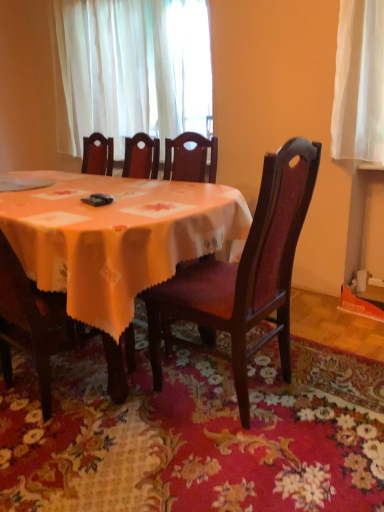
This screenshot has width=384, height=512. What are the coordinates of `white sheer curtain at upper center` in the screenshot? It's located at (130, 69).

The image size is (384, 512). What are the coordinates of `wooden chair at center, the first chair when ordered from left to right` in the screenshot? It's located at (45, 329).

The height and width of the screenshot is (512, 384). What do you see at coordinates (245, 273) in the screenshot?
I see `matte wood chair at center, which is the first chair in right-to-left order` at bounding box center [245, 273].

You are a GUI agent. You are given a task and a screenshot of the screen. Output one action in this format:
    pyautogui.click(x=<x>, y=<y>)
    Task: Click on the floral carpet at lower center
    This screenshot has height=512, width=384.
    Given the screenshot: What is the action you would take?
    pyautogui.click(x=195, y=432)

From a real-world perspective, is white sheer curtain at upper center on top of matte orange tablecloth at center?

Yes, from a real-world perspective, white sheer curtain at upper center is above matte orange tablecloth at center.

Are white sheer curtain at upper center and matte orange tablecloth at center far apart?

Yes.

Is white sheer curtain at upper center positioned with its back to matte orange tablecloth at center?

No, white sheer curtain at upper center is not facing the opposite direction of matte orange tablecloth at center.

I want to click on kitchen & dining room table that is in front of the white sheer curtain at upper center, so click(115, 242).

Is white sheer curtain at upper center bigger than matte wood chair at center, which appears as the second chair when viewed from the left?

Yes.

Would you say white sheer curtain at upper center is outside matte wood chair at center, which appears as the second chair when viewed from the left?

Absolutely, white sheer curtain at upper center is external to matte wood chair at center, which appears as the second chair when viewed from the left.

Where is `curtain on the left of the matte wood chair at center, which is the first chair in right-to-left order`? This screenshot has height=512, width=384. curtain on the left of the matte wood chair at center, which is the first chair in right-to-left order is located at coordinates (130, 69).

Measure the distance from white sheer curtain at upper center to matte wood chair at center, which is the first chair in right-to-left order.

The distance of white sheer curtain at upper center from matte wood chair at center, which is the first chair in right-to-left order, is 1.62 meters.

Based on the photo, which object is further away from the camera taking this photo, floral carpet at lower center or wooden chair at center, the 2th chair when ordered from right to left?

wooden chair at center, the 2th chair when ordered from right to left.

How far apart are floral carpet at lower center and wooden chair at center, the first chair when ordered from left to right?

floral carpet at lower center is 37.75 centimeters from wooden chair at center, the first chair when ordered from left to right.

From the image's perspective, is floral carpet at lower center over wooden chair at center, the 2th chair when ordered from right to left?

No.

From a real-world perspective, which is physically below, floral carpet at lower center or wooden chair at center, the first chair when ordered from left to right?

From a 3D spatial view, floral carpet at lower center is below.

Could matte orange tablecloth at center be considered to be inside floral carpet at lower center?

No, matte orange tablecloth at center is not a part of floral carpet at lower center.

Between floral carpet at lower center and matte orange tablecloth at center, which one appears on the right side from the viewer's perspective?

floral carpet at lower center.

Which point is more forward, (x=133, y=438) or (x=183, y=197)?

The point (x=133, y=438) is closer.

Which point is more distant from viewer, (x=105, y=452) or (x=10, y=179)?

The point (x=10, y=179) is more distant.

Would you say floral carpet at lower center is outside white glossy plate at upper left?

Yes, floral carpet at lower center is located beyond the bounds of white glossy plate at upper left.

From the image's perspective, between floral carpet at lower center and white glossy plate at upper left, which one is located above?

white glossy plate at upper left appears higher in the image.

In the scene shown: Is floral carpet at lower center shorter than white glossy plate at upper left?

In fact, floral carpet at lower center may be taller than white glossy plate at upper left.

Is point (42, 182) positioned before point (293, 215)?

No, it is not.

How different are the orientations of white glossy plate at upper left and matte wood chair at center, which is the first chair in right-to-left order, in degrees?

There is a 90.1-degree angle between the facing directions of white glossy plate at upper left and matte wood chair at center, which is the first chair in right-to-left order.

Is white glossy plate at upper left far away from matte wood chair at center, which appears as the second chair when viewed from the left?

Absolutely, white glossy plate at upper left is distant from matte wood chair at center, which appears as the second chair when viewed from the left.

Between white glossy plate at upper left and matte wood chair at center, which appears as the second chair when viewed from the left, which one is positioned in front?

matte wood chair at center, which appears as the second chair when viewed from the left, is more forward.

Between matte wood chair at center, which is the first chair in right-to-left order, and wooden chair at center, the first chair when ordered from left to right, which one has larger width?

matte wood chair at center, which is the first chair in right-to-left order, is wider.

In terms of height, does matte wood chair at center, which appears as the second chair when viewed from the left, look taller or shorter compared to wooden chair at center, the 2th chair when ordered from right to left?

Considering their sizes, matte wood chair at center, which appears as the second chair when viewed from the left, has more height than wooden chair at center, the 2th chair when ordered from right to left.

Is the position of matte wood chair at center, which appears as the second chair when viewed from the left, less distant than that of wooden chair at center, the 2th chair when ordered from right to left?

Yes, it is.

Who is bigger, matte wood chair at center, which is the first chair in right-to-left order, or wooden chair at center, the first chair when ordered from left to right?

Bigger between the two is matte wood chair at center, which is the first chair in right-to-left order.

Locate an element on the screen. This screenshot has height=512, width=384. curtain that is on the right side of matte orange tablecloth at center is located at coordinates (130, 69).

There is a white sheer curtain at upper center. Identify the location of the 1st chair below it (from the image's perspective). This screenshot has height=512, width=384. (245, 273).

Based on their spatial positions, is white sheer curtain at upper center or white glossy plate at upper left closer to floral carpet at lower center?

Based on the image, white glossy plate at upper left appears to be nearer to floral carpet at lower center.

From the image, which object appears to be farther from white sheer curtain at upper center, matte wood chair at center, which appears as the second chair when viewed from the left, or matte orange tablecloth at center?

matte wood chair at center, which appears as the second chair when viewed from the left.

Based on their spatial positions, is white glossy plate at upper left or white sheer curtain at upper center closer to wooden chair at center, the 2th chair when ordered from right to left?

The object closer to wooden chair at center, the 2th chair when ordered from right to left, is white glossy plate at upper left.

Based on their spatial positions, is floral carpet at lower center or matte wood chair at center, which is the first chair in right-to-left order, further from white sheer curtain at upper center?

floral carpet at lower center.

When comparing their distances from white glossy plate at upper left, does matte wood chair at center, which is the first chair in right-to-left order, or floral carpet at lower center seem closer?

matte wood chair at center, which is the first chair in right-to-left order, lies closer to white glossy plate at upper left than the other object.

When comparing their distances from white glossy plate at upper left, does white sheer curtain at upper center or floral carpet at lower center seem closer?

The object closer to white glossy plate at upper left is white sheer curtain at upper center.

Estimate the real-world distances between objects in this image. Which object is closer to matte orange tablecloth at center, matte wood chair at center, which is the first chair in right-to-left order, or white glossy plate at upper left?

matte wood chair at center, which is the first chair in right-to-left order, is closer to matte orange tablecloth at center.

Which object lies further to the anchor point white sheer curtain at upper center, matte orange tablecloth at center or matte wood chair at center, which is the first chair in right-to-left order?

Based on the image, matte wood chair at center, which is the first chair in right-to-left order, appears to be further to white sheer curtain at upper center.

Find the location of a particular element. kitchen & dining room table between white sheer curtain at upper center and matte wood chair at center, which is the first chair in right-to-left order, vertically is located at coordinates (115, 242).

You are a GUI agent. You are given a task and a screenshot of the screen. Output one action in this format:
    pyautogui.click(x=<x>, y=<y>)
    Task: Click on the chair between white sheer curtain at upper center and wooden chair at center, the first chair when ordered from left to right, vertically
    
    Given the screenshot: What is the action you would take?
    pyautogui.click(x=245, y=273)

This screenshot has width=384, height=512. Identify the location of chair located between matte orange tablecloth at center and white glossy plate at upper left in the depth direction. (45, 329).

Identify the location of tableware that lies between white sheer curtain at upper center and wooden chair at center, the first chair when ordered from left to right, from top to bottom. (22, 184).